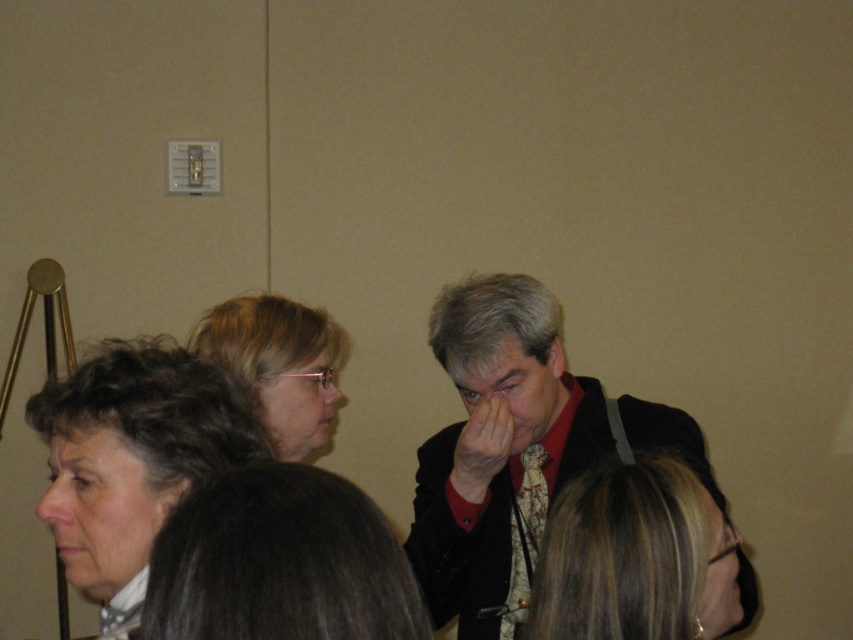
Question: Does dark red shirt at center appear on the left side of dark brown hair at center?

Choices:
 (A) no
 (B) yes

Answer: (A)

Question: Can you confirm if dark brown hair at lower left is thinner than blonde hair at center?

Choices:
 (A) yes
 (B) no

Answer: (B)

Question: Which object is closer to the camera taking this photo?

Choices:
 (A) blonde hair at center
 (B) matte skin nose at center
 (C) matte black hair at center

Answer: (A)

Question: Which of the following is the closest to the observer?

Choices:
 (A) (488, 595)
 (B) (294, 496)
 (C) (96, 401)
 (D) (283, 422)

Answer: (B)

Question: Which point is farther to the camera?

Choices:
 (A) pos(426,528)
 (B) pos(189,468)
 (C) pos(57,524)
 (D) pos(679,572)

Answer: (A)

Question: Is matte black hair at center positioned in front of matte skin nose at lower left?

Choices:
 (A) no
 (B) yes

Answer: (A)